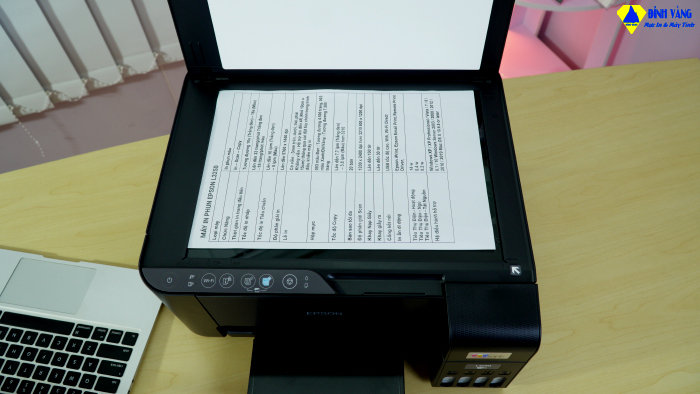
Image resolution: width=700 pixels, height=394 pixels. Find the location of `keyboard`. keyboard is located at coordinates (42, 341).